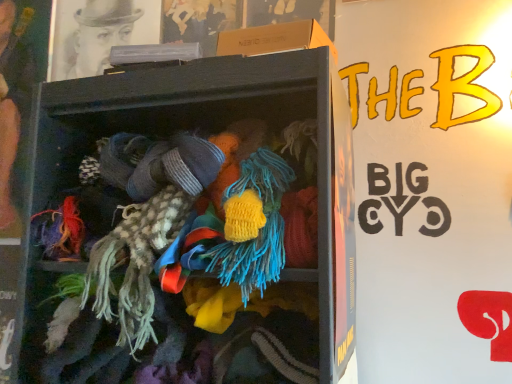
Question: Can you confirm if smooth skin face at left is positioned to the right of wooden shelf at center?

Choices:
 (A) yes
 (B) no

Answer: (B)

Question: From a real-world perspective, is smooth skin face at left located higher than wooden shelf at center?

Choices:
 (A) no
 (B) yes

Answer: (B)

Question: Is smooth skin face at left thinner than wooden shelf at center?

Choices:
 (A) yes
 (B) no

Answer: (A)

Question: Is smooth skin face at left aimed at wooden shelf at center?

Choices:
 (A) yes
 (B) no

Answer: (B)

Question: Does smooth skin face at left have a greater width compared to wooden shelf at center?

Choices:
 (A) no
 (B) yes

Answer: (A)

Question: Is smooth skin face at left not close to wooden shelf at center?

Choices:
 (A) no
 (B) yes

Answer: (A)

Question: Is wooden shelf at center aimed at smooth skin face at left?

Choices:
 (A) yes
 (B) no

Answer: (B)

Question: Is wooden shelf at center next to smooth skin face at left and touching it?

Choices:
 (A) no
 (B) yes

Answer: (A)

Question: Is wooden shelf at center turned away from smooth skin face at left?

Choices:
 (A) no
 (B) yes

Answer: (A)

Question: Does wooden shelf at center have a greater width compared to smooth skin face at left?

Choices:
 (A) yes
 (B) no

Answer: (A)

Question: From the image's perspective, would you say wooden shelf at center is shown under smooth skin face at left?

Choices:
 (A) no
 (B) yes

Answer: (B)

Question: Is wooden shelf at center thinner than smooth skin face at left?

Choices:
 (A) yes
 (B) no

Answer: (B)

Question: Considering their positions, is smooth skin face at left located in front of or behind wooden shelf at center?

Choices:
 (A) front
 (B) behind

Answer: (B)